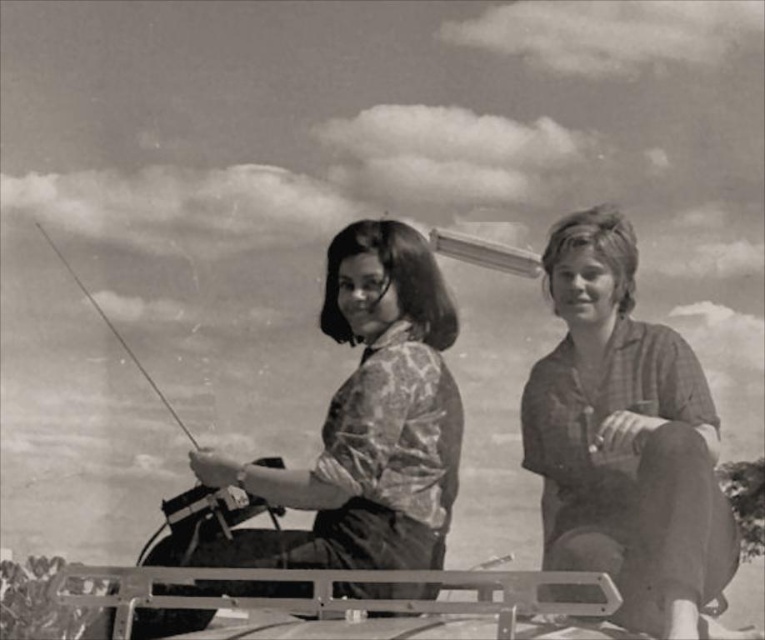
In the scene shown: You are a photographer analyzing this black and white photo. You notice two shirts in the scene. The plaid shirt at right and the patterned fabric shirt at center. Which shirt is positioned lower in the image?

The plaid shirt at right is located below the patterned fabric shirt at center, so the plaid shirt at right is positioned lower in the image.

You are a tailor who needs to determine which shirt requires more fabric between the plaid shirt at right and the patterned fabric shirt at center. Which one would need more fabric?

The plaid shirt at right is bigger than the patterned fabric shirt at center, so it would require more fabric.